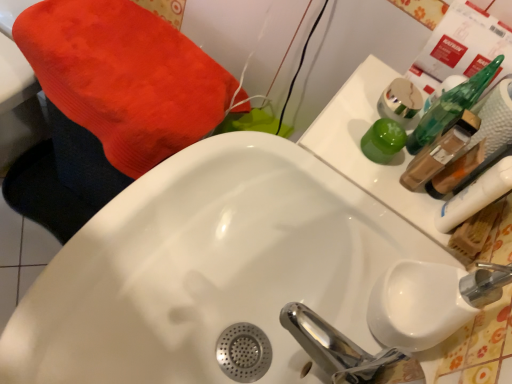
I want to click on free location to the left of green glossy cup at upper right, arranged as the second mouthwash when viewed from the top, so click(x=325, y=127).